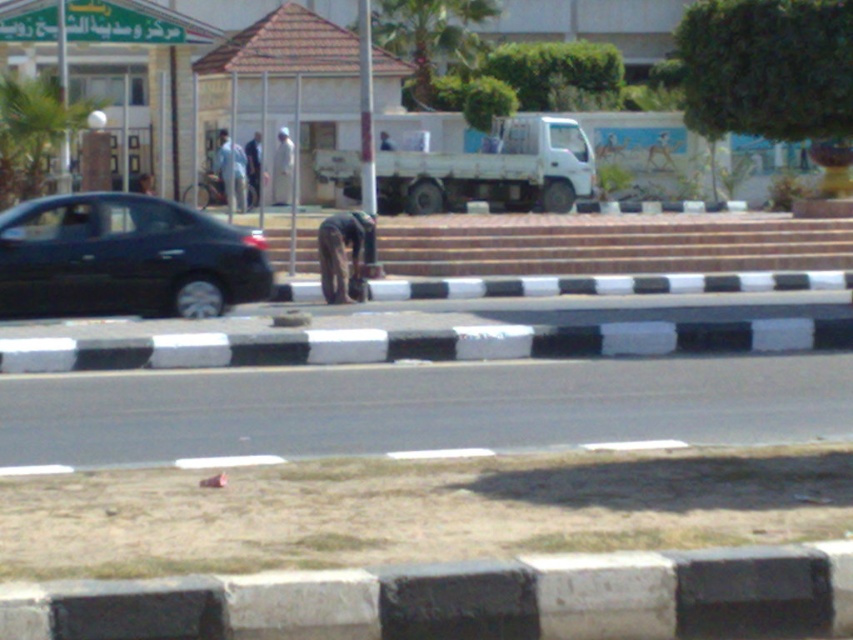
Question: Does light beige fabric at center appear on the right side of light brown fabric pants at center?

Choices:
 (A) yes
 (B) no

Answer: (A)

Question: Is green leafy palm tree at upper left further to the viewer compared to light brown fabric pants at center?

Choices:
 (A) yes
 (B) no

Answer: (B)

Question: Considering the real-world distances, which object is farthest from the light brown fabric pants at center?

Choices:
 (A) shiny black sedan at left
 (B) dark brown fabric at center

Answer: (A)

Question: Which point appears farthest from the camera in this image?

Choices:
 (A) (276, 160)
 (B) (341, 227)
 (C) (12, 182)

Answer: (A)

Question: Considering the relative positions of green leafy palm tree at upper center and light brown fabric pants at center in the image provided, where is green leafy palm tree at upper center located with respect to light brown fabric pants at center?

Choices:
 (A) left
 (B) right

Answer: (B)

Question: Which of the following is the closest to the observer?

Choices:
 (A) (358, 262)
 (B) (469, 22)
 (C) (252, 202)

Answer: (A)